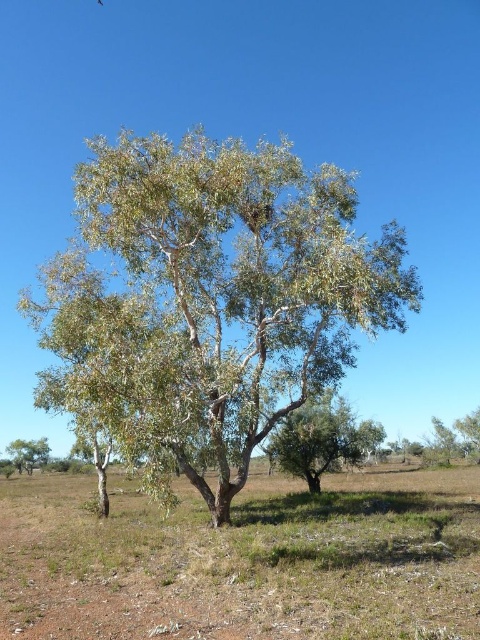
Is brown soil at center positioned behind green leafy tree at lower left?

No.

Which of these two, brown soil at center or green leafy tree at lower left, stands shorter?

green leafy tree at lower left is shorter.

Who is more forward, (80, 577) or (34, 440)?

Point (80, 577) is in front.

Identify the location of brown soil at center. Image resolution: width=480 pixels, height=640 pixels. (244, 560).

Which of these two, white papery bark tree at center or green leafy tree at center, stands shorter?

Standing shorter between the two is green leafy tree at center.

This screenshot has height=640, width=480. Describe the element at coordinates (210, 298) in the screenshot. I see `white papery bark tree at center` at that location.

The width and height of the screenshot is (480, 640). Identify the location of white papery bark tree at center. (210, 298).

Between green leafy tree at center and green leafy tree at lower left, which one appears on the right side from the viewer's perspective?

Positioned to the right is green leafy tree at center.

Is green leafy tree at center behind green leafy tree at lower left?

No.

Which is in front, point (294, 424) or point (13, 456)?

Point (294, 424) is more forward.

Where is `green leafy tree at center`? green leafy tree at center is located at coordinates (322, 440).